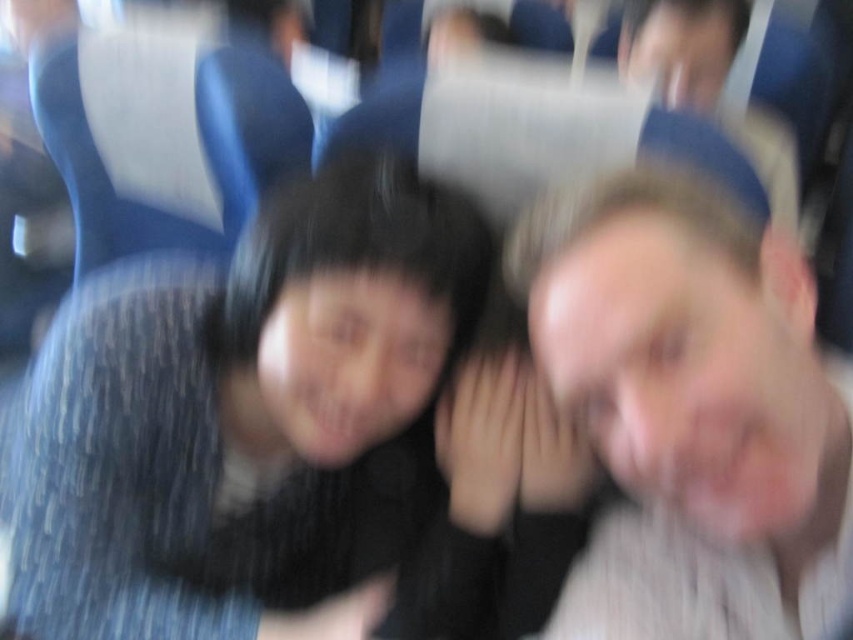
You are a photographer standing at the scene. You want to take a clear photo of the matte black hair at center. Considering the current image is blurred due to motion or focus issues, what adjustment should you make to ensure the subject is sharp?

Since the matte black hair at center is only 29.02 inches away from the viewer, adjusting the camera focus to a shorter focal length or moving closer to the subject could help achieve a sharper image by reducing motion blur and ensuring proper focus on the matte black hair at center.

You are a photographer trying to capture a candid moment of two people on a train. You notice the matte black hair at center and the smooth skin face at right. Based on their positions, which object is positioned lower in the image?

The matte black hair at center is located below smooth skin face at right, so the matte black hair at center is positioned lower in the image.